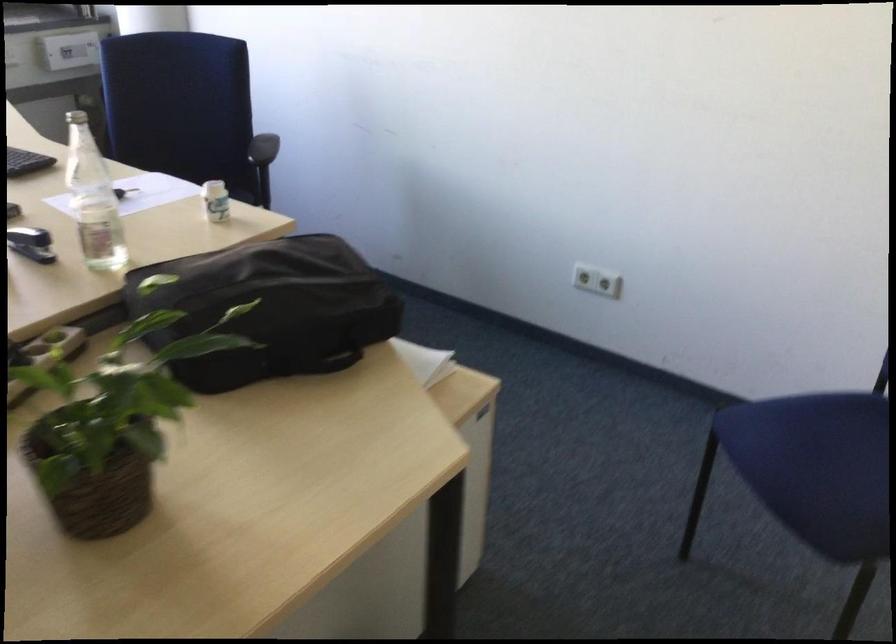
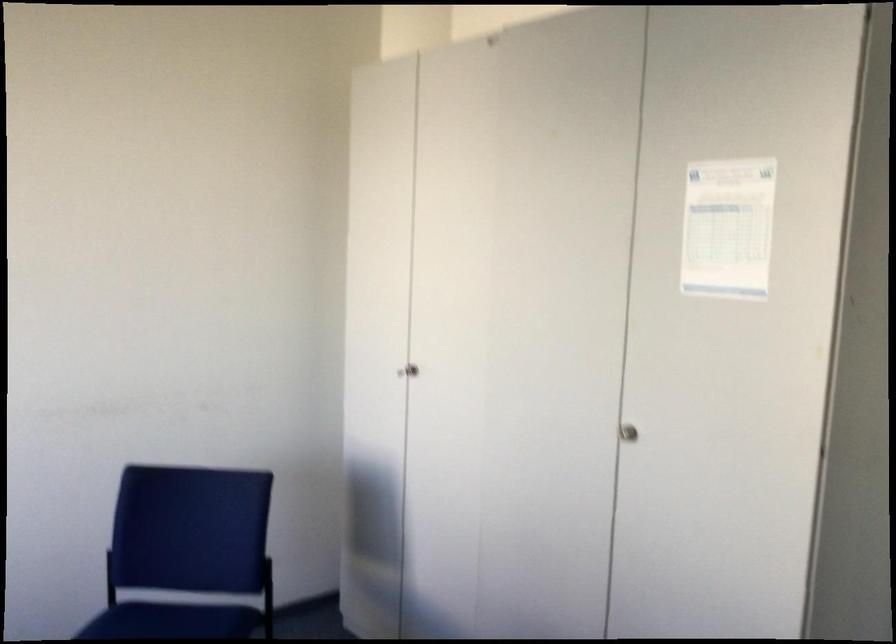
Question: Based on the continuous images, in which direction is the camera rotating? Reply with the corresponding letter.

Choices:
 (A) Left
 (B) Right
 (C) Up
 (D) Down

Answer: (B)